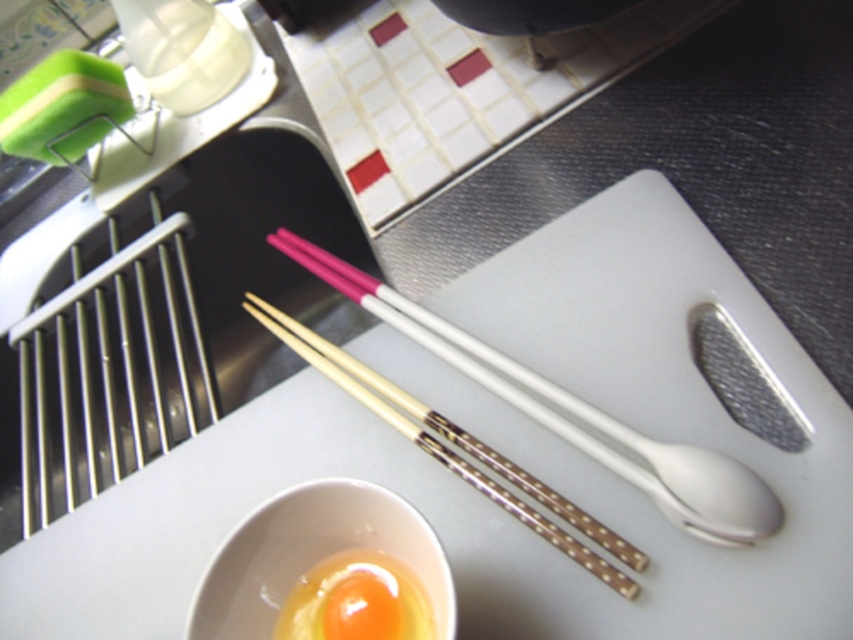
Does white plastic spoon at center appear on the left side of white ceramic bowl at lower center?

In fact, white plastic spoon at center is to the right of white ceramic bowl at lower center.

Can you confirm if white plastic spoon at center is taller than white ceramic bowl at lower center?

Correct, white plastic spoon at center is much taller as white ceramic bowl at lower center.

At what (x,y) coordinates should I click in order to perform the action: click on white plastic spoon at center. Please return your answer as a coordinate pair (x, y). Looking at the image, I should click on (572, 413).

I want to click on wooden chopsticks at center, so click(457, 448).

Between wooden chopsticks at center and smooth yellow egg at center, which one appears on the right side from the viewer's perspective?

wooden chopsticks at center is more to the right.

Is point (556, 508) closer to viewer compared to point (392, 636)?

That is False.

What are the coordinates of `wooden chopsticks at center` in the screenshot? It's located at (457, 448).

Does white plastic spoon at center lie in front of wooden chopsticks at center?

Yes, white plastic spoon at center is in front of wooden chopsticks at center.

Does white plastic spoon at center have a lesser height compared to wooden chopsticks at center?

No, white plastic spoon at center is not shorter than wooden chopsticks at center.

Is point (730, 525) positioned behind point (370, 374)?

No, it is not.

I want to click on white plastic spoon at center, so click(x=572, y=413).